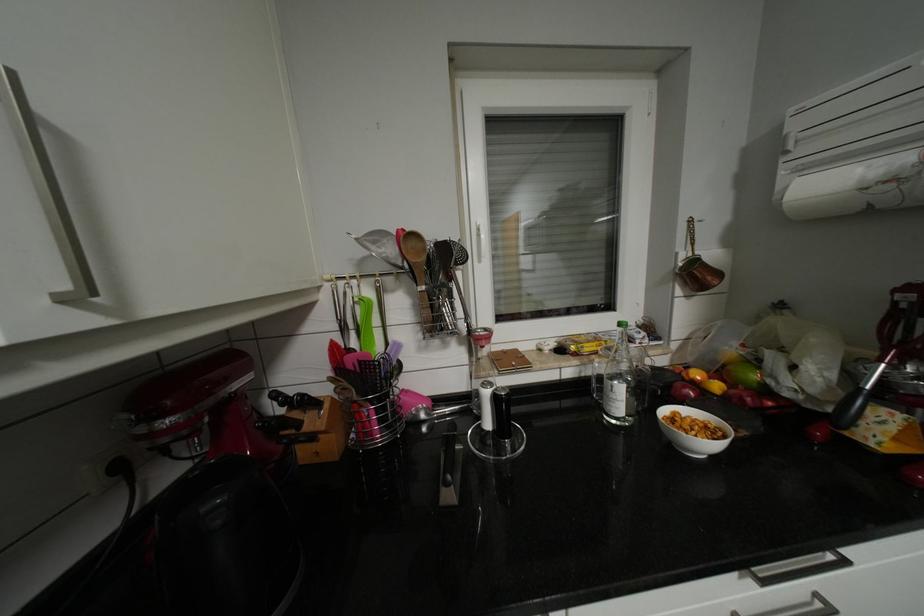
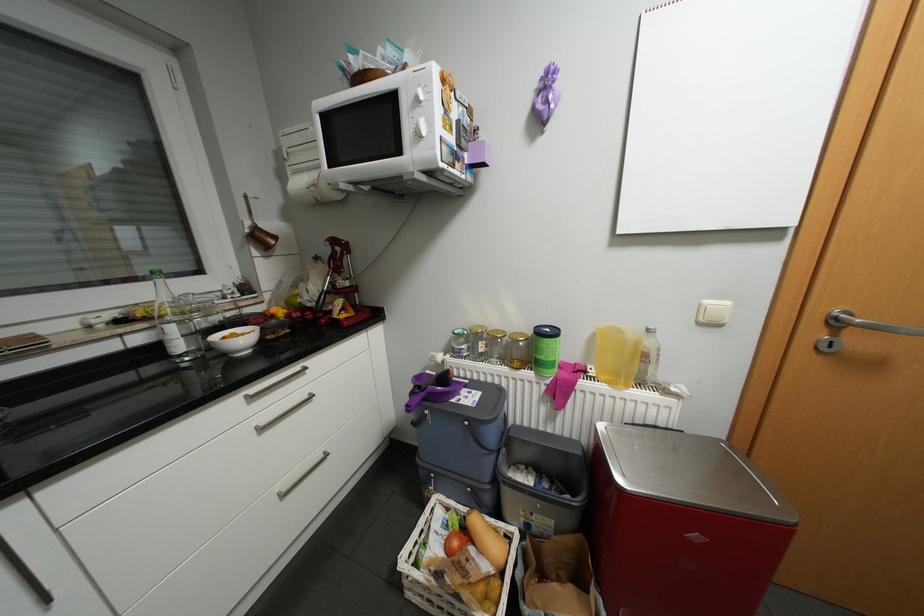
Find the pixel in the second image that matches the point at 795,392 in the first image.

(317, 304)